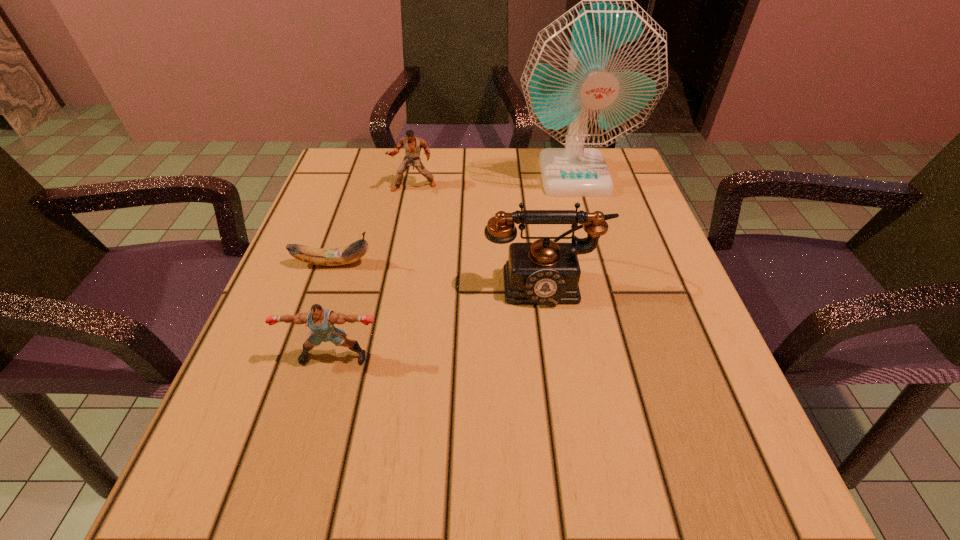
Locate an element on the screen. The image size is (960, 540). vacant space located 0.190m at the stem of the shortest object is located at coordinates (473, 264).

What are the coordinates of `fan that is at the far edge` in the screenshot? It's located at (594, 75).

The width and height of the screenshot is (960, 540). I want to click on puncher that is positioned at the far edge, so click(412, 144).

This screenshot has height=540, width=960. Identify the location of banana located at the left edge. (348, 254).

At what (x,y) coordinates should I click in order to perform the action: click on fan located at the right edge. Please return your answer as a coordinate pair (x, y). Looking at the image, I should click on (594, 75).

Locate an element on the screen. telephone at the right edge is located at coordinates (544, 272).

I want to click on object that is at the far left corner, so click(412, 144).

This screenshot has height=540, width=960. I want to click on object located in the far right corner section of the desktop, so click(x=594, y=75).

In the image, there is a desktop. Find the location of `free space at the far edge`. free space at the far edge is located at coordinates (439, 149).

Locate an element on the screen. vacant area at the near edge is located at coordinates (541, 489).